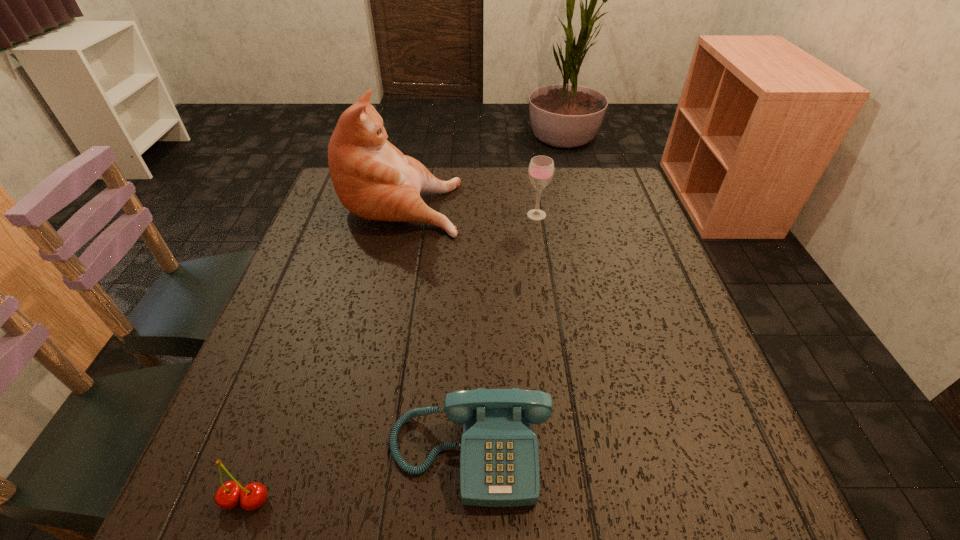
You are a GUI agent. You are given a task and a screenshot of the screen. Output one action in this format:
    pyautogui.click(x=<x>, y=<y>)
    Task: Click on the cherry situated at the near edge
    This screenshot has height=540, width=960.
    Given the screenshot: What is the action you would take?
    pyautogui.click(x=230, y=494)

I want to click on cat at the left edge, so click(x=374, y=180).

At what (x,y) coordinates should I click in order to perform the action: click on cherry at the left edge. Please return your answer as a coordinate pair (x, y). Image resolution: width=960 pixels, height=540 pixels. Looking at the image, I should click on (230, 494).

Identify the location of object that is at the far left corner. The width and height of the screenshot is (960, 540). (374, 180).

You are a GUI agent. You are given a task and a screenshot of the screen. Output one action in this format:
    pyautogui.click(x=<x>, y=<y>)
    Task: Click on the object that is at the near left corner
    The image size is (960, 540).
    Given the screenshot: What is the action you would take?
    pyautogui.click(x=230, y=494)

The height and width of the screenshot is (540, 960). I want to click on vacant space at the far edge, so click(x=551, y=211).

Where is `vacant space at the left edge of the desktop`? The height and width of the screenshot is (540, 960). vacant space at the left edge of the desktop is located at coordinates (307, 291).

The image size is (960, 540). What are the coordinates of `free space at the right edge of the desktop` in the screenshot? It's located at (623, 235).

In the image, there is a desktop. Where is `free space at the near left corner`? Image resolution: width=960 pixels, height=540 pixels. free space at the near left corner is located at coordinates (259, 480).

This screenshot has width=960, height=540. I want to click on vacant area that lies between the telephone and the cat, so click(436, 327).